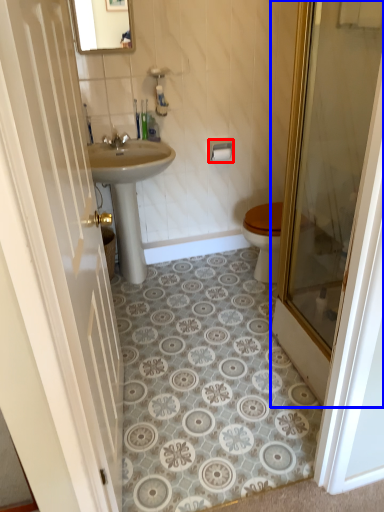
Question: Which of the following is the closest to the observer, towel bar (highlighted by a red box) or door (highlighted by a blue box)?

Choices:
 (A) towel bar
 (B) door

Answer: (B)